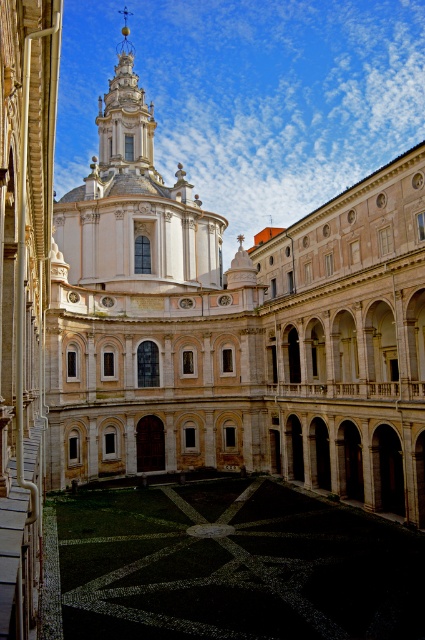
Locate an element on the screen. white marble church at center is located at coordinates (235, 326).

This screenshot has width=425, height=640. I want to click on white marble church at center, so click(x=235, y=326).